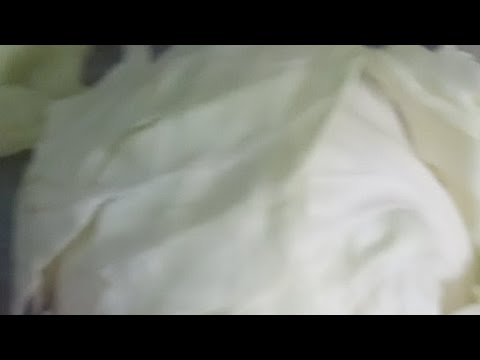
Locate an element on the screen. white sheet is located at coordinates (338, 220).